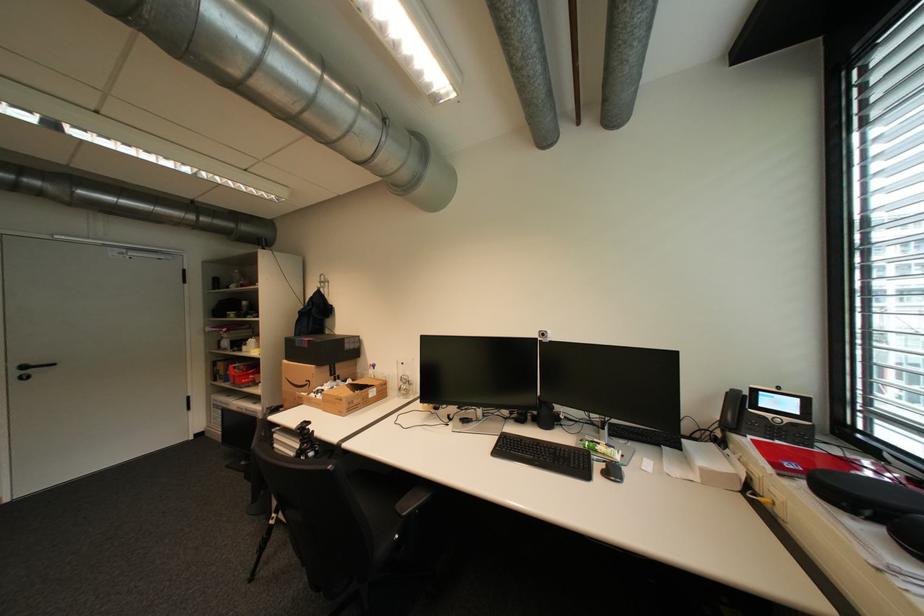
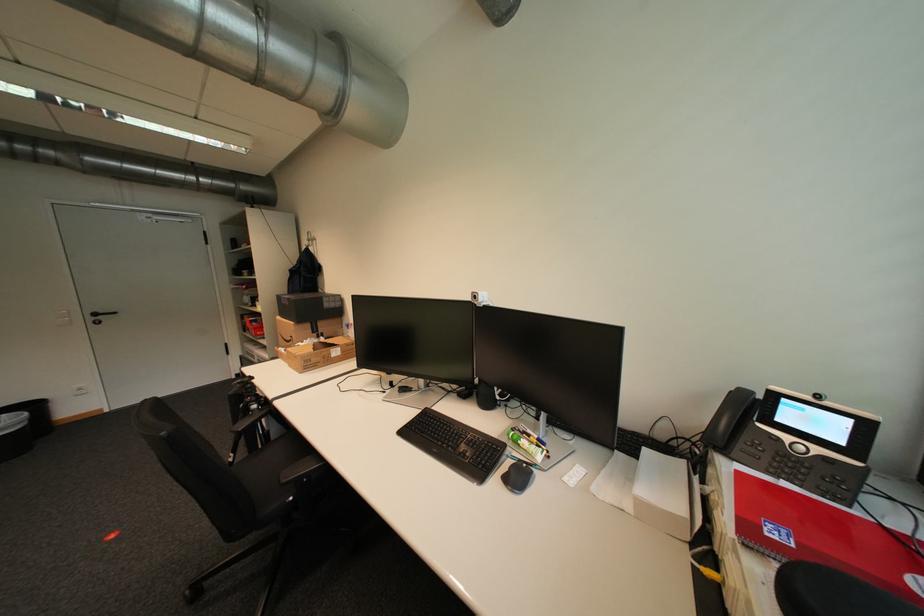
The images are taken continuously from a first-person perspective. In which direction are you moving?

The cameraman moved toward right, forward.